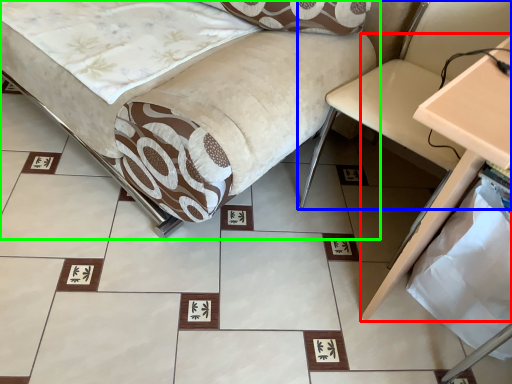
Question: Which is farther away from table (highlighted by a red box)? swivel chair (highlighted by a blue box) or furniture (highlighted by a green box)?

Choices:
 (A) swivel chair
 (B) furniture

Answer: (B)